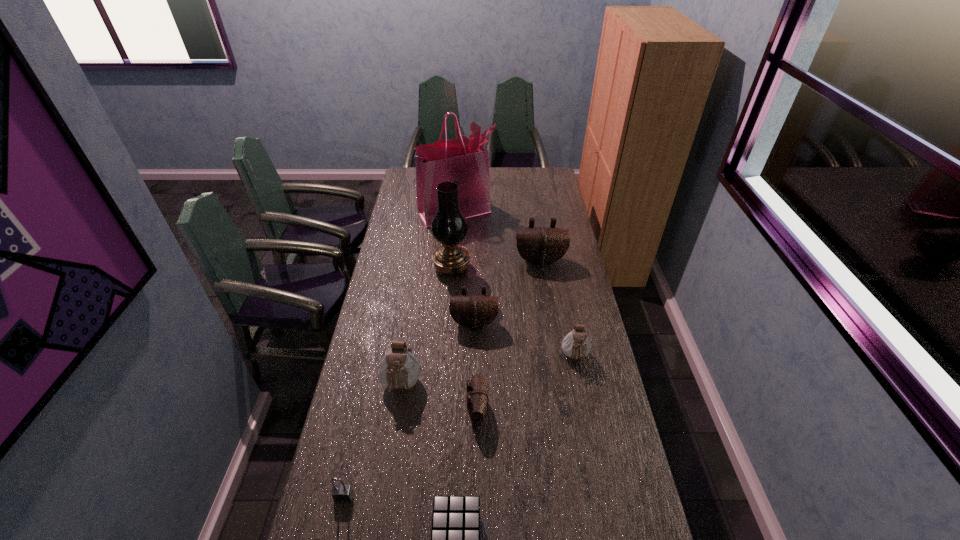
Find the location of a particular element. The image size is (960, 540). vacant area between the oil lamp and the smaller white pouch is located at coordinates 514,313.

Locate an element on the screen. This screenshot has width=960, height=540. free area in between the smallest brown pouch and the leftmost pouch is located at coordinates (440, 398).

Locate which object is the fourth closest to the smaller white pouch. Please provide its 2D coordinates. Your answer should be formatted as a tuple, i.e. [(x, y)], where the tuple contains the x and y coordinates of a point satisfying the conditions above.

[(449, 226)]

I want to click on object that can be found as the closest to the sixth nearest object, so click(x=399, y=369).

Identify which pouch is the second nearest to the leftmost pouch. Please provide its 2D coordinates. Your answer should be formatted as a tuple, i.e. [(x, y)], where the tuple contains the x and y coordinates of a point satisfying the conditions above.

[(473, 311)]

The width and height of the screenshot is (960, 540). I want to click on pouch that is the closest to the red cube, so click(x=477, y=398).

Locate an element on the screen. the second closest brown pouch to the red cube is located at coordinates (473, 311).

Identify the location of brown pouch identified as the second closest to the farthest pouch. Image resolution: width=960 pixels, height=540 pixels. (477, 398).